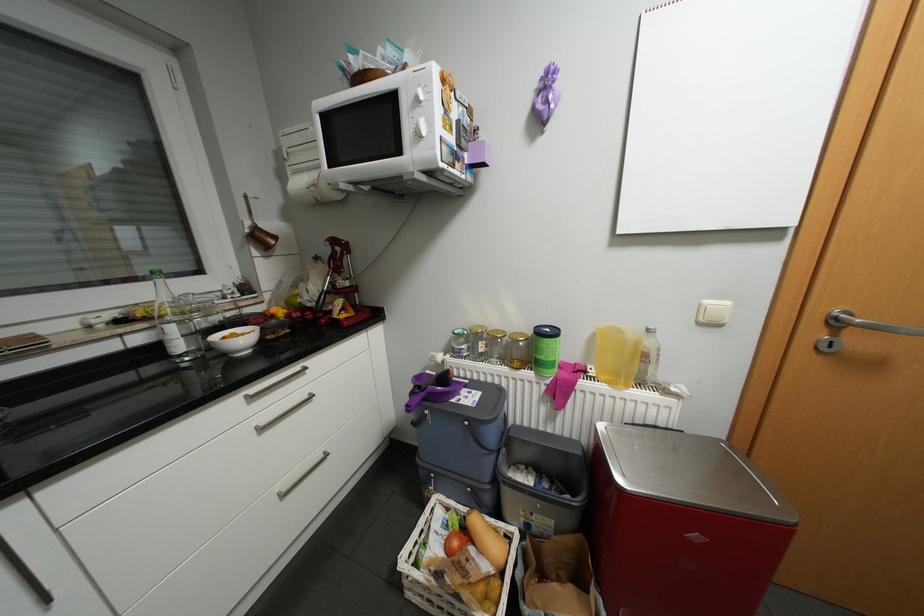
Image resolution: width=924 pixels, height=616 pixels. What are the coordinates of `white window handle` in the screenshot? It's located at (96, 318).